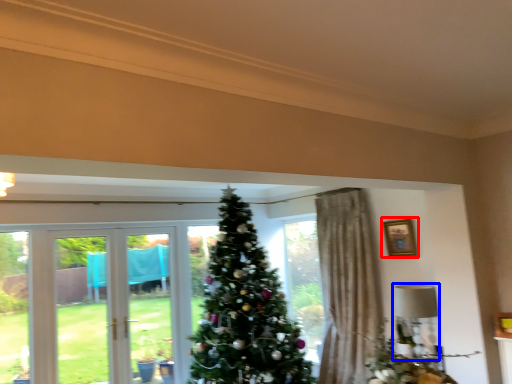
Question: Among these objects, which one is farthest to the camera, picture frame (highlighted by a red box) or lamp (highlighted by a blue box)?

Choices:
 (A) picture frame
 (B) lamp

Answer: (A)